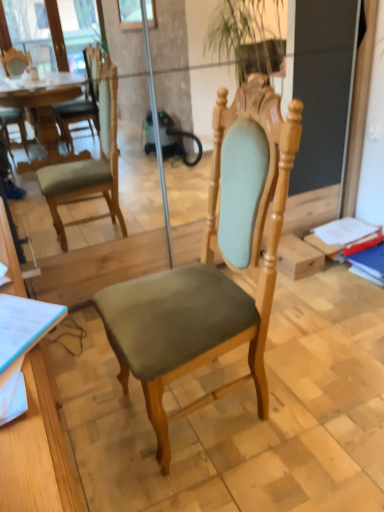
Question: Is wooden desk at lower left outside matte green fabric chair at center?

Choices:
 (A) yes
 (B) no

Answer: (A)

Question: Is wooden desk at lower left positioned behind matte green fabric chair at center?

Choices:
 (A) yes
 (B) no

Answer: (B)

Question: From a real-world perspective, is wooden desk at lower left on top of matte green fabric chair at center?

Choices:
 (A) no
 (B) yes

Answer: (A)

Question: From the image's perspective, is wooden desk at lower left on top of matte green fabric chair at center?

Choices:
 (A) no
 (B) yes

Answer: (A)

Question: Considering the relative sizes of wooden desk at lower left and matte green fabric chair at center in the image provided, is wooden desk at lower left taller than matte green fabric chair at center?

Choices:
 (A) no
 (B) yes

Answer: (A)

Question: Is wooden desk at lower left closer to camera compared to matte green fabric chair at center?

Choices:
 (A) no
 (B) yes

Answer: (B)

Question: Is matte green fabric chair at center located outside wooden desk at lower left?

Choices:
 (A) yes
 (B) no

Answer: (A)

Question: Could you tell me if matte green fabric chair at center is turned towards wooden desk at lower left?

Choices:
 (A) yes
 (B) no

Answer: (A)

Question: Does matte green fabric chair at center have a greater width compared to wooden desk at lower left?

Choices:
 (A) no
 (B) yes

Answer: (B)

Question: Would you say matte green fabric chair at center is a long distance from wooden desk at lower left?

Choices:
 (A) no
 (B) yes

Answer: (A)

Question: From the image's perspective, is matte green fabric chair at center located beneath wooden desk at lower left?

Choices:
 (A) yes
 (B) no

Answer: (B)

Question: From a real-world perspective, is matte green fabric chair at center under wooden desk at lower left?

Choices:
 (A) yes
 (B) no

Answer: (B)

Question: From the image's perspective, is wooden desk at lower left positioned above or below matte green fabric chair at center?

Choices:
 (A) below
 (B) above

Answer: (A)